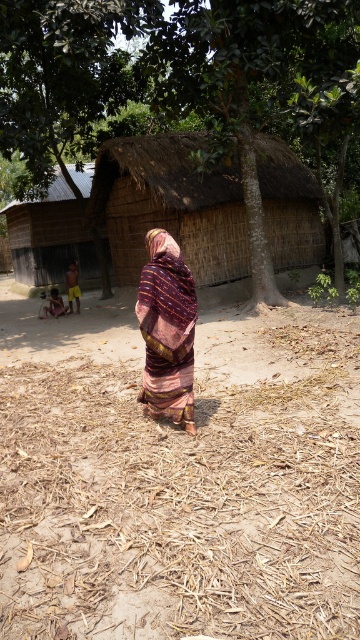
You are a traveler who wants to take a photo of the thatched straw hut at center without the green leafy tree at center blocking the view. Is there a way to position yourself so that the tree is not in front of the hut?

The green leafy tree at center is bigger than the thatched straw hut at center, so if you move to the side of the tree, you can position yourself so that the tree is not blocking the view of the thatched straw hut at center.

You are standing in a rural area and see the brown dry grass at center and the thatched straw hut at center. Which object is closer to you?

The brown dry grass at center is closer to you since it is in front of the thatched straw hut at center.